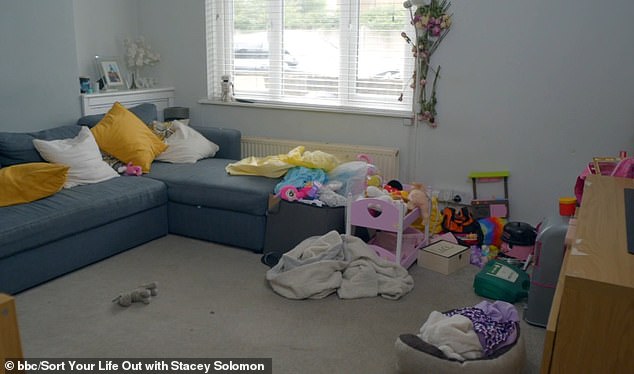
The image size is (634, 374). Identify the location of pillows. (189, 143), (131, 141), (78, 158), (33, 180).